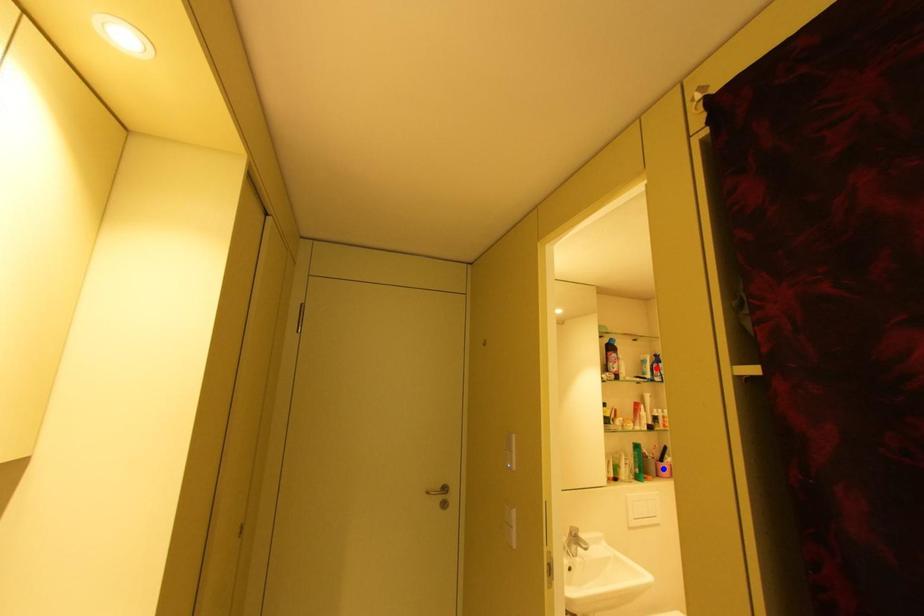
Question: In the image, two points are highlighted. Which point is nearer to the camera? Reply with the corresponding letter.

Choices:
 (A) blue point
 (B) red point

Answer: (B)